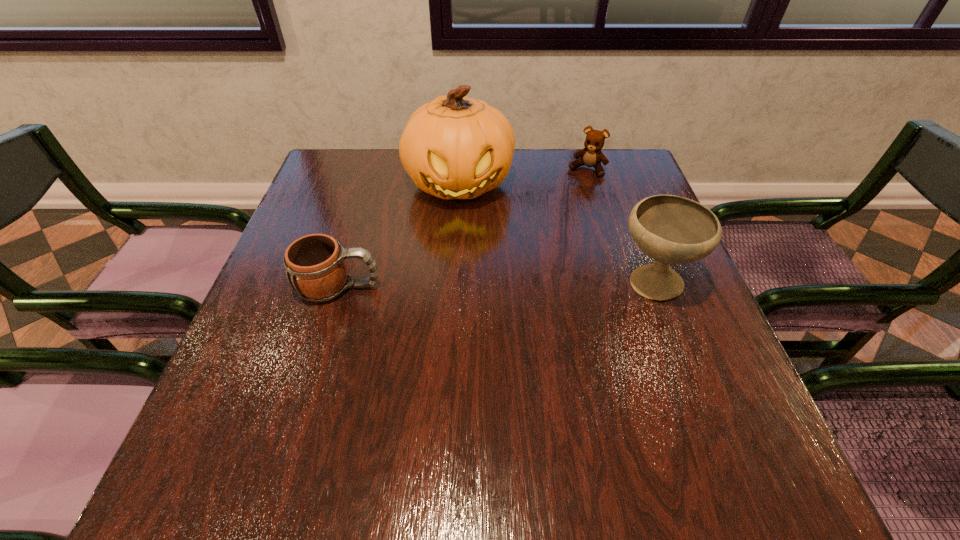
What are the coordinates of `the leftmost object` in the screenshot? It's located at (316, 268).

Where is `chalice`? This screenshot has height=540, width=960. chalice is located at coordinates (670, 229).

Where is `teddy bear`? This screenshot has height=540, width=960. teddy bear is located at coordinates (591, 156).

The height and width of the screenshot is (540, 960). I want to click on the second object from left to right, so click(454, 147).

At what (x,y) coordinates should I click in order to perform the action: click on pumpkin. Please return your answer as a coordinate pair (x, y). Image resolution: width=960 pixels, height=540 pixels. Looking at the image, I should click on (454, 147).

Locate an element on the screen. The width and height of the screenshot is (960, 540). free space located 0.200m on the side of the leftmost object with the handle is located at coordinates (475, 287).

At what (x,y) coordinates should I click in order to perform the action: click on free space located on the back of the chalice. Please return your answer as a coordinate pair (x, y). This screenshot has height=540, width=960. Looking at the image, I should click on (607, 163).

The image size is (960, 540). What are the coordinates of `vacant space located 0.250m on the front-facing side of the teddy bear` in the screenshot? It's located at (551, 229).

Identify the location of vacant area situated 0.120m on the front-facing side of the teddy bear. (567, 200).

This screenshot has height=540, width=960. I want to click on free point located on the front-facing side of the teddy bear, so click(x=570, y=197).